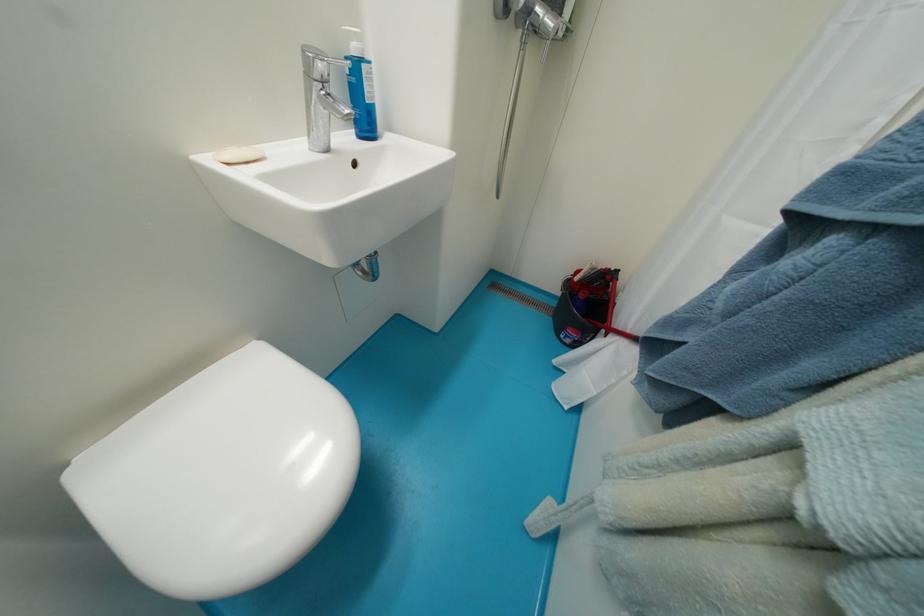
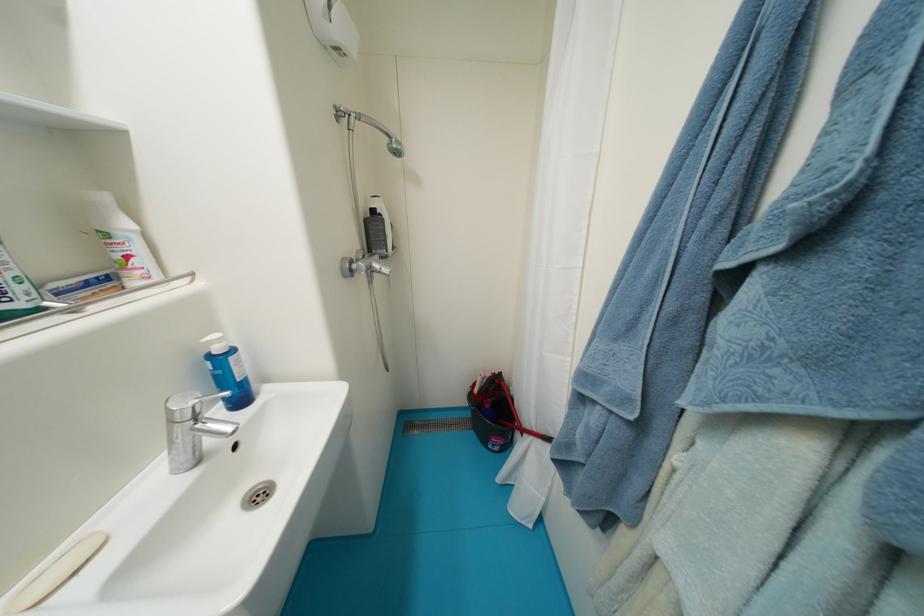
Question: I am providing you with two images of the same scene from different viewpoints. Which of the following objects are not visible in image2?

Choices:
 (A) silver shower head
 (B) white plastic bottle
 (C) white bar of soap
 (D) none of these

Answer: (D)